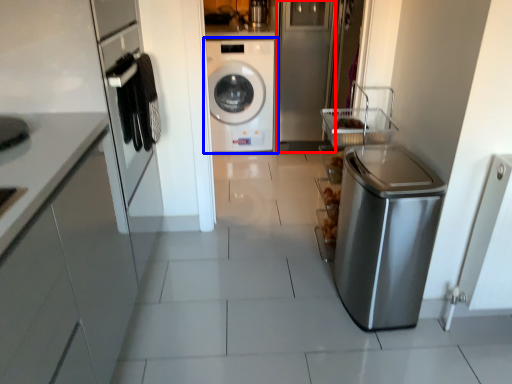
Question: Among these objects, which one is farthest to the camera, glass door (highlighted by a red box) or washing machine (highlighted by a blue box)?

Choices:
 (A) glass door
 (B) washing machine

Answer: (B)